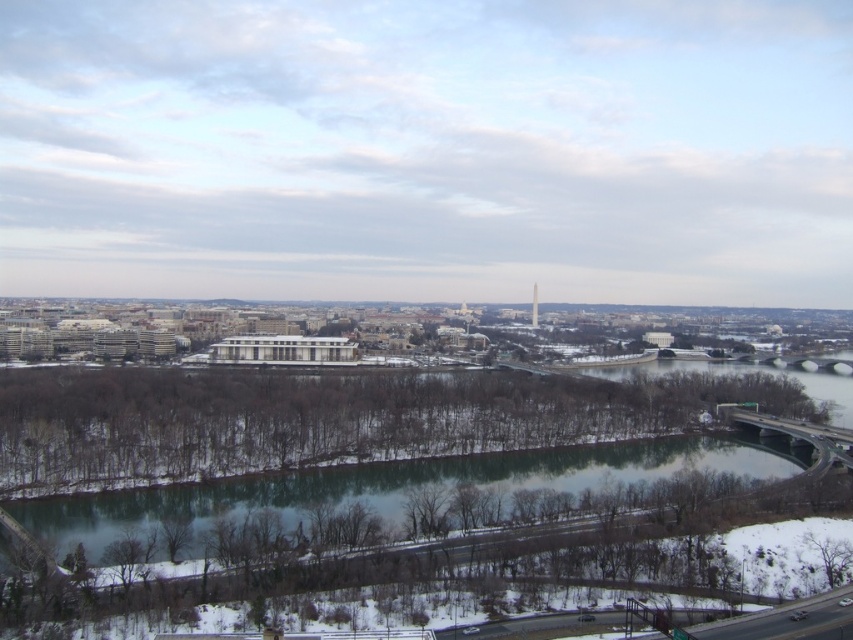
Question: From the image, what is the correct spatial relationship of greenish-blue water at center in relation to metallic gold tower at center?

Choices:
 (A) below
 (B) above

Answer: (A)

Question: Which object is the farthest from the metallic gold tower at center?

Choices:
 (A) snowy white river at center
 (B) greenish-blue water at center

Answer: (B)

Question: Which is nearer to the metallic gold tower at center?

Choices:
 (A) snowy white river at center
 (B) greenish-blue water at center

Answer: (A)

Question: Which object appears farthest from the camera in this image?

Choices:
 (A) metallic gold tower at center
 (B) greenish-blue water at center

Answer: (A)

Question: Can you confirm if snowy white river at center is wider than greenish-blue water at center?

Choices:
 (A) yes
 (B) no

Answer: (A)

Question: Does greenish-blue water at center appear on the left side of metallic gold tower at center?

Choices:
 (A) yes
 (B) no

Answer: (A)